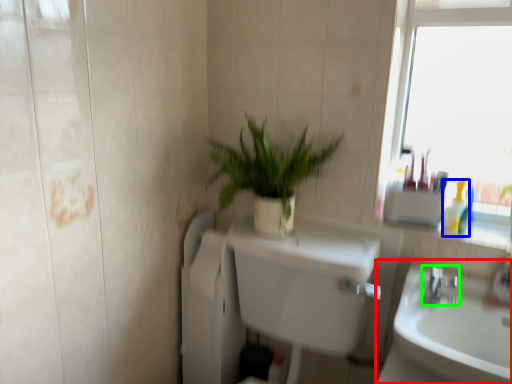
Question: Considering the real-world distances, which object is closest to sink (highlighted by a red box)? toiletry (highlighted by a blue box) or tap (highlighted by a green box).

Choices:
 (A) toiletry
 (B) tap

Answer: (B)